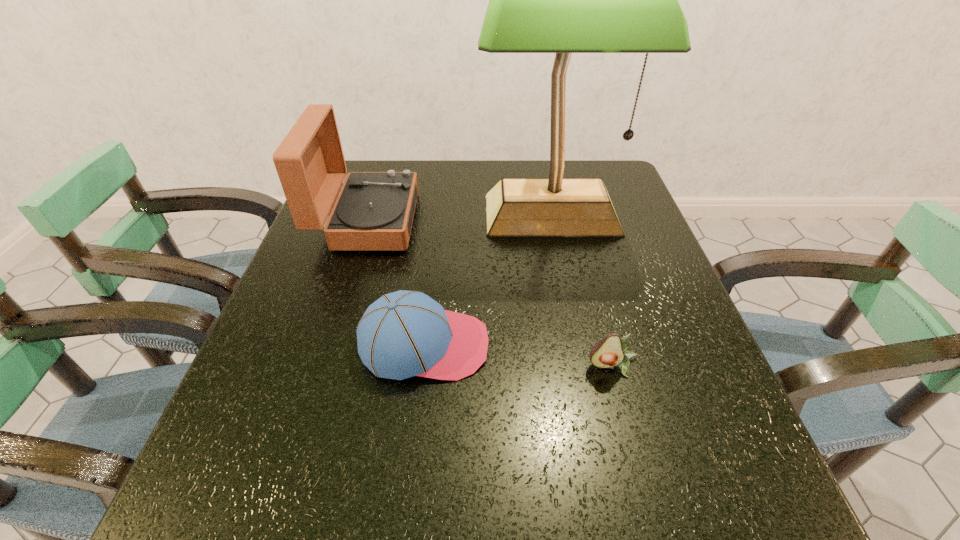
Find the location of `free spot between the baseball cap and the phonograph record`. free spot between the baseball cap and the phonograph record is located at coordinates (396, 283).

Where is `free space between the avocado and the phonograph record`? This screenshot has height=540, width=960. free space between the avocado and the phonograph record is located at coordinates (490, 293).

Find the location of a particular element. The image size is (960, 540). unoccupied position between the baseball cap and the phonograph record is located at coordinates (396, 283).

The image size is (960, 540). In order to click on unoccupied position between the phonograph record and the tallest object in this screenshot , I will do `click(459, 218)`.

You are a GUI agent. You are given a task and a screenshot of the screen. Output one action in this format:
    pyautogui.click(x=<x>, y=<y>)
    Task: Click on the free space between the tallest object and the phonograph record
    
    Given the screenshot: What is the action you would take?
    pyautogui.click(x=459, y=218)

Where is `unoccupied area between the phonograph record and the avocado`? The image size is (960, 540). unoccupied area between the phonograph record and the avocado is located at coordinates (490, 293).

Where is `vacant region between the avocado and the phonograph record`? The height and width of the screenshot is (540, 960). vacant region between the avocado and the phonograph record is located at coordinates (490, 293).

Where is `empty space that is in between the table lamp and the third shortest object`? This screenshot has height=540, width=960. empty space that is in between the table lamp and the third shortest object is located at coordinates (459, 218).

This screenshot has width=960, height=540. Find the location of `blank region between the avocado and the tallest object`. blank region between the avocado and the tallest object is located at coordinates coord(582,291).

This screenshot has height=540, width=960. I want to click on vacant space in between the second tallest object and the avocado, so click(490, 293).